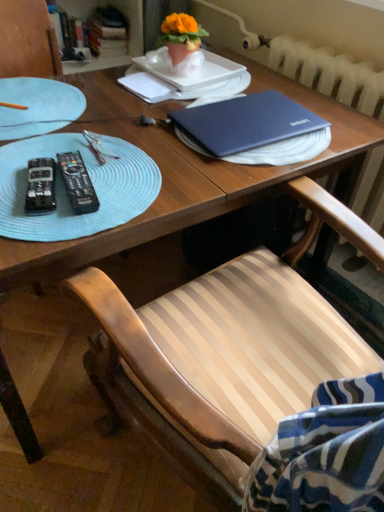
Question: Considering the relative sizes of light blue textured glass plate at left, the 1th glass plate in the top-to-bottom sequence, and white textured radiator at upper right in the image provided, is light blue textured glass plate at left, the 1th glass plate in the top-to-bottom sequence, thinner than white textured radiator at upper right?

Choices:
 (A) no
 (B) yes

Answer: (A)

Question: Considering the relative sizes of light blue textured glass plate at left, the 1th glass plate in the top-to-bottom sequence, and white textured radiator at upper right in the image provided, is light blue textured glass plate at left, the 1th glass plate in the top-to-bottom sequence, smaller than white textured radiator at upper right?

Choices:
 (A) no
 (B) yes

Answer: (B)

Question: Considering the relative sizes of light blue textured glass plate at left, the second glass plate when ordered from bottom to top, and white textured radiator at upper right in the image provided, is light blue textured glass plate at left, the second glass plate when ordered from bottom to top, taller than white textured radiator at upper right?

Choices:
 (A) no
 (B) yes

Answer: (A)

Question: Is light blue textured glass plate at left, the 1th glass plate in the top-to-bottom sequence, completely or partially outside of white textured radiator at upper right?

Choices:
 (A) no
 (B) yes

Answer: (B)

Question: From a real-world perspective, does light blue textured glass plate at left, the 1th glass plate in the top-to-bottom sequence, stand above white textured radiator at upper right?

Choices:
 (A) yes
 (B) no

Answer: (A)

Question: Based on their sizes in the image, would you say hardcover book at upper left, which appears as the 2th book when viewed from the right, is bigger or smaller than matte blue laptop at center?

Choices:
 (A) small
 (B) big

Answer: (A)

Question: Is hardcover book at upper left, which appears as the 2th book when viewed from the right, wider or thinner than matte blue laptop at center?

Choices:
 (A) thin
 (B) wide

Answer: (A)

Question: Would you say hardcover book at upper left, which appears as the 2th book when viewed from the right, is to the left or to the right of matte blue laptop at center in the picture?

Choices:
 (A) right
 (B) left

Answer: (B)

Question: Considering the positions of point (64, 59) and point (292, 109), is point (64, 59) closer or farther from the camera than point (292, 109)?

Choices:
 (A) closer
 (B) farther

Answer: (B)

Question: Considering their positions, is hardcover book at upper left, the second book in the left-to-right sequence, located in front of or behind black plastic remote control at left, the first remote control viewed from the right?

Choices:
 (A) front
 (B) behind

Answer: (B)

Question: In terms of size, does hardcover book at upper left, which is the first book from right to left, appear bigger or smaller than black plastic remote control at left, which is counted as the second remote control, starting from the left?

Choices:
 (A) big
 (B) small

Answer: (A)

Question: Considering the relative positions of hardcover book at upper left, which is the first book from right to left, and black plastic remote control at left, the first remote control viewed from the right, in the image provided, is hardcover book at upper left, which is the first book from right to left, to the left or to the right of black plastic remote control at left, the first remote control viewed from the right,?

Choices:
 (A) left
 (B) right

Answer: (A)

Question: Is hardcover book at upper left, which is the first book from right to left, taller or shorter than black plastic remote control at left, the first remote control viewed from the right?

Choices:
 (A) short
 (B) tall

Answer: (B)

Question: Choose the correct answer: Is orange matte flower pot at upper center inside black plastic remote control at left, the 2th remote control when ordered from right to left, or outside it?

Choices:
 (A) inside
 (B) outside

Answer: (B)

Question: Is point (183, 35) closer or farther from the camera than point (41, 203)?

Choices:
 (A) closer
 (B) farther

Answer: (B)